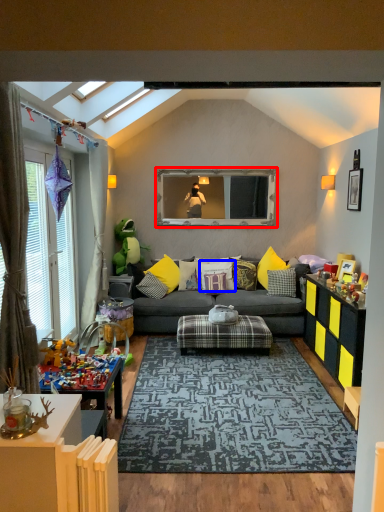
Question: Which object appears farthest to the camera in this image, window screen (highlighted by a red box) or pillow (highlighted by a blue box)?

Choices:
 (A) window screen
 (B) pillow

Answer: (A)